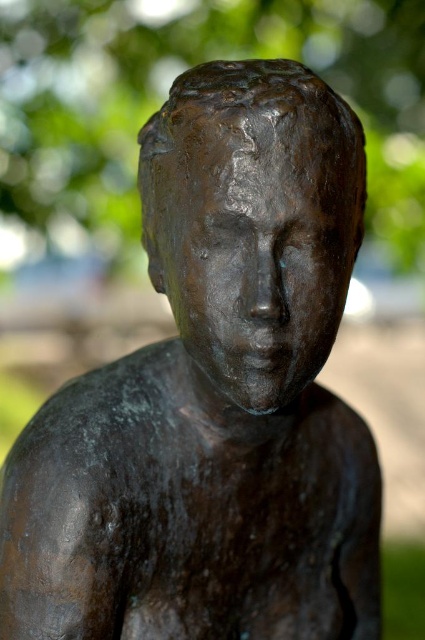
Is green matte tree at center shorter than bronze statue at center?

No, green matte tree at center is not shorter than bronze statue at center.

Does point (79, 140) come closer to viewer compared to point (345, 141)?

No, (79, 140) is further to viewer.

Does point (317, 8) come farther from viewer compared to point (326, 115)?

Yes, point (317, 8) is farther from viewer.

I want to click on green matte tree at center, so click(167, 88).